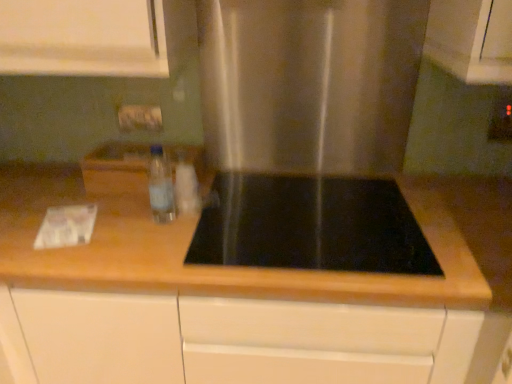
Question: Does point (496, 112) appear closer or farther from the camera than point (175, 192)?

Choices:
 (A) closer
 (B) farther

Answer: (B)

Question: From a real-world perspective, relative to translucent plastic bottle at center, the 1th bottle in the right-to-left sequence, is matte plastic electric outlet at upper right vertically above or below?

Choices:
 (A) above
 (B) below

Answer: (A)

Question: Considering the real-world distances, which object is closest to the matte plastic electric outlet at upper right?

Choices:
 (A) clear plastic bottle at center, the second bottle viewed from the right
 (B) black glass gas stove at center
 (C) wooden at center
 (D) translucent plastic bottle at center, the 1th bottle in the right-to-left sequence

Answer: (B)

Question: Which object is the farthest from the wooden at center?

Choices:
 (A) black glass gas stove at center
 (B) clear plastic bottle at center, placed as the first bottle when sorted from left to right
 (C) translucent plastic bottle at center, acting as the second bottle starting from the left
 (D) matte plastic electric outlet at upper right

Answer: (D)